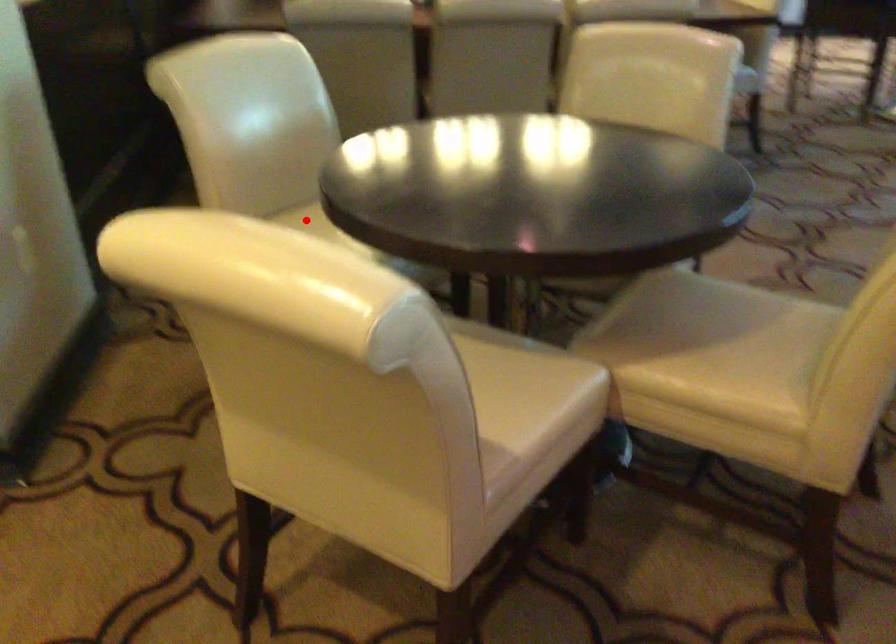
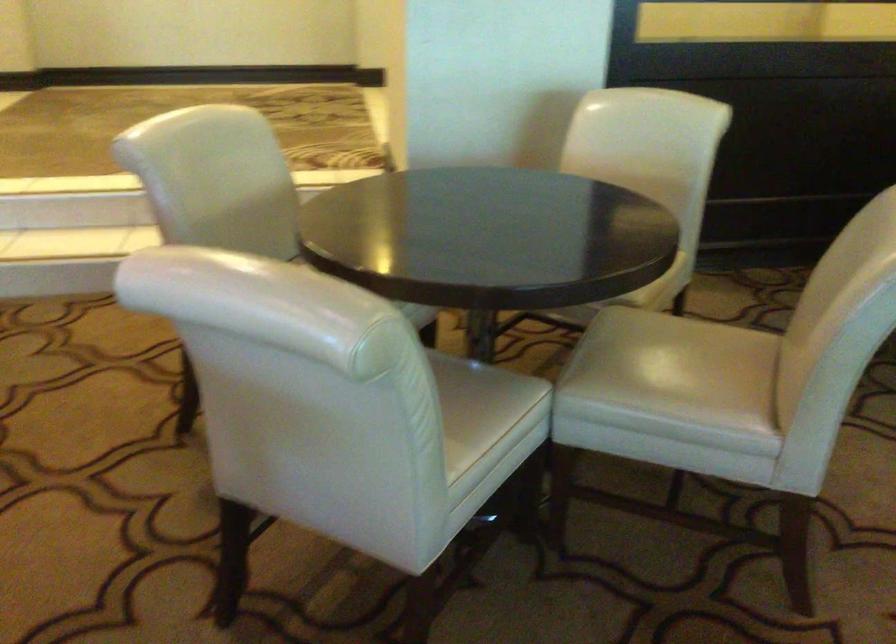
Question: I am providing you with two images of the same scene from different viewpoints. A red point is marked on the first image. Is the red point's position out of view in image 2?

Choices:
 (A) Yes
 (B) No

Answer: (A)